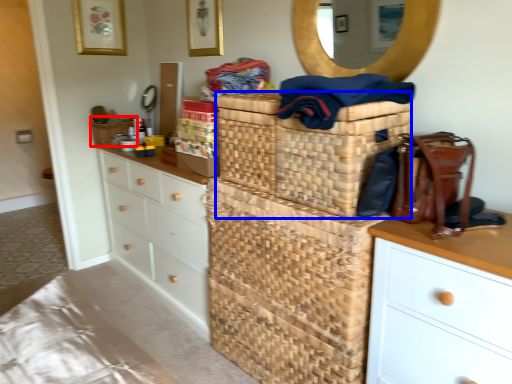
Question: Which object appears farthest to the camera in this image, basket (highlighted by a red box) or basket (highlighted by a blue box)?

Choices:
 (A) basket
 (B) basket

Answer: (A)